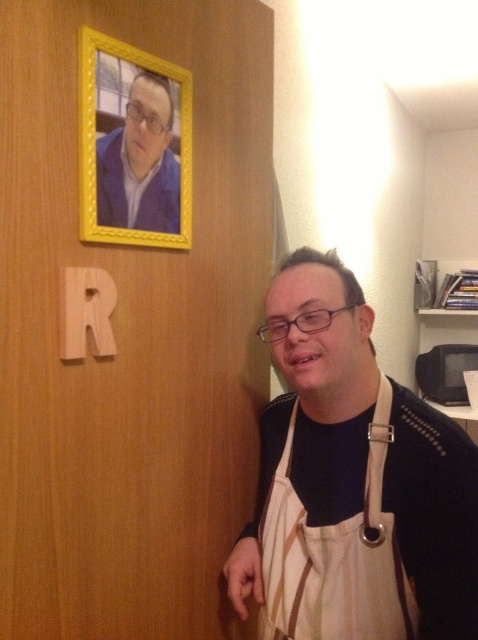
Between point (257, 580) and point (380, 512), which one is positioned in front?

Point (380, 512) is more forward.

Which is above, beige apron at right or beige canvas apron at lower right?

beige apron at right is higher up.

Identify the location of beige apron at right. The width and height of the screenshot is (478, 640). (352, 483).

Find the location of a particular element. beige apron at right is located at coordinates (352, 483).

Between point (325, 595) and point (125, 113), which one is positioned behind?

The point (325, 595) is behind.

Does beige canvas apron at lower right appear over yellow wood picture frame at upper left?

No.

Is point (269, 611) farther from camera compared to point (123, 134)?

Yes, point (269, 611) is farther from viewer.

Locate an element on the screen. This screenshot has height=640, width=478. beige canvas apron at lower right is located at coordinates (335, 556).

Between beige apron at right and yellow wood picture frame at upper left, which one is positioned higher?

yellow wood picture frame at upper left

Find the location of a particular element. The image size is (478, 640). beige apron at right is located at coordinates (352, 483).